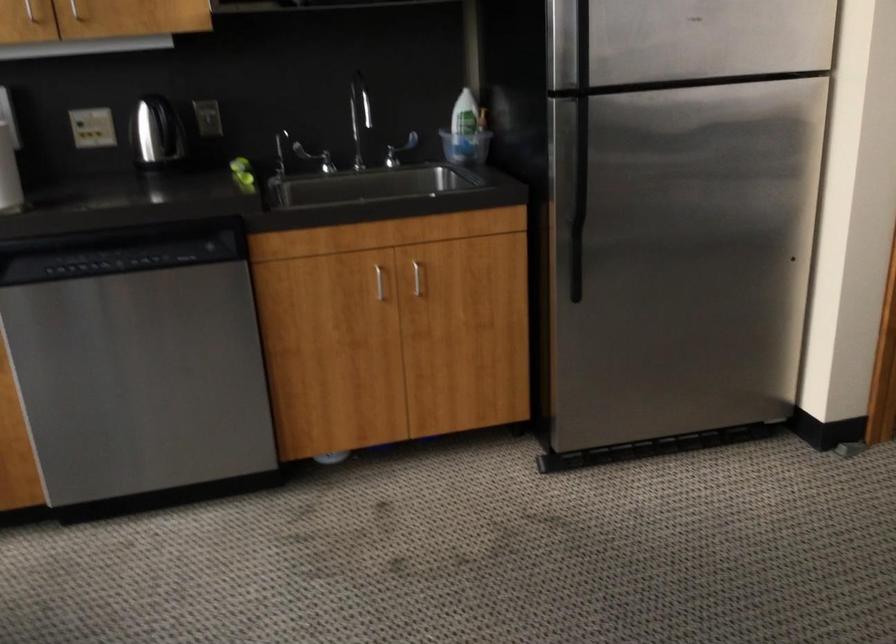
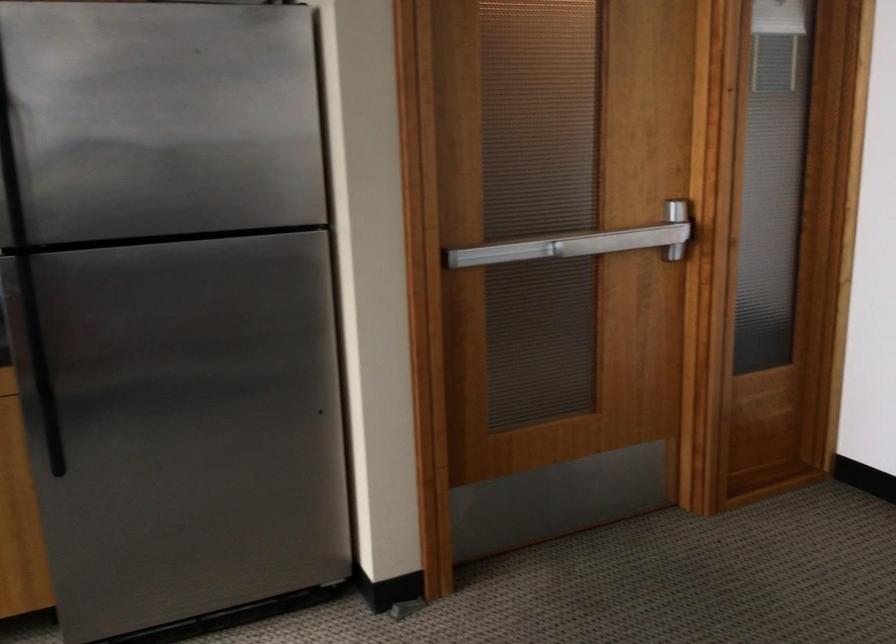
The point at [552,185] is marked in the first image. Where is the corresponding point in the second image?

(37, 352)